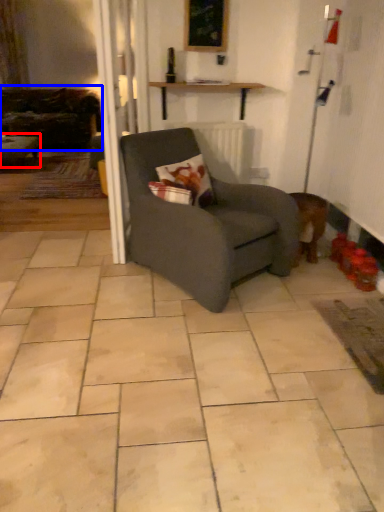
Question: Which object appears farthest to the camera in this image, table (highlighted by a red box) or studio couch (highlighted by a blue box)?

Choices:
 (A) table
 (B) studio couch

Answer: (B)